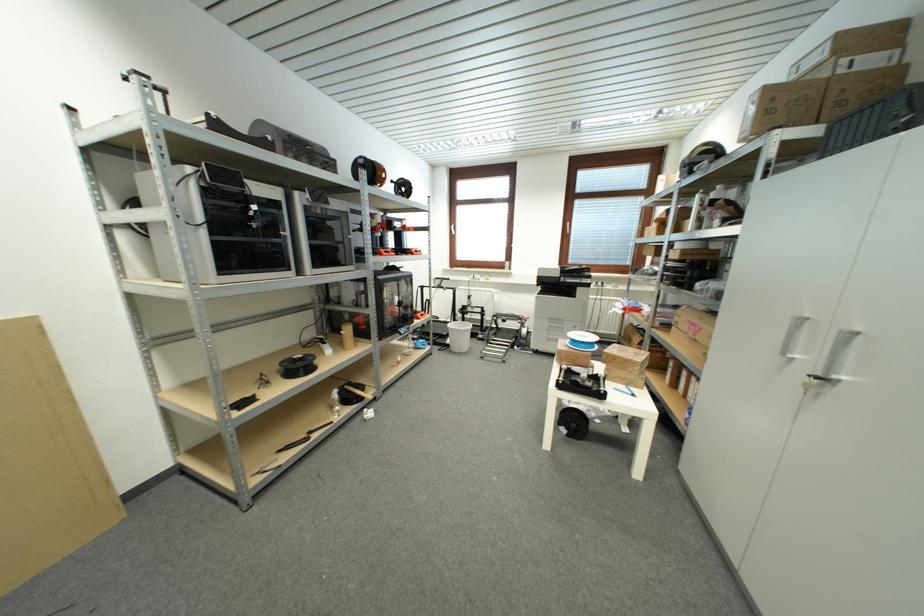
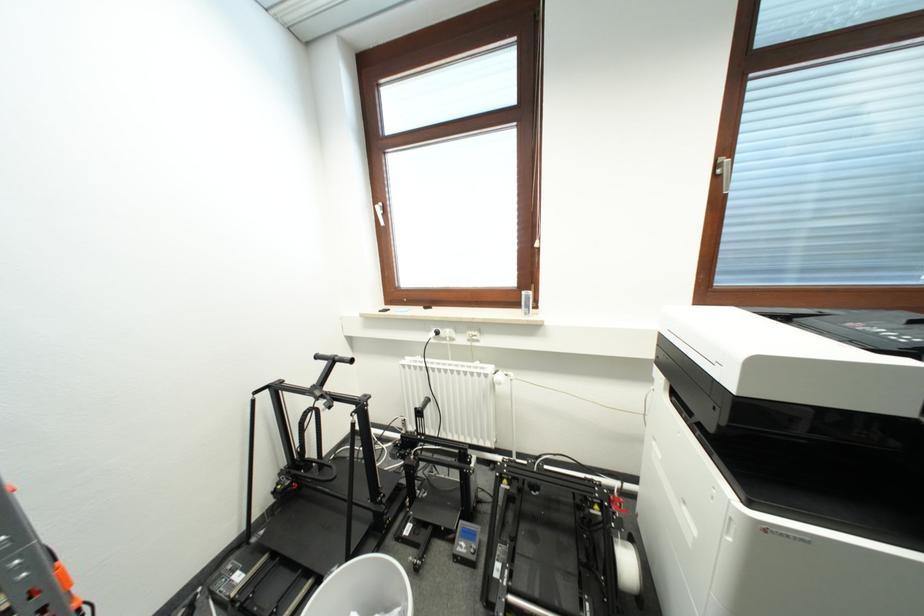
Find the pixel in the second image that matches (496,292) in the first image.

(494, 371)